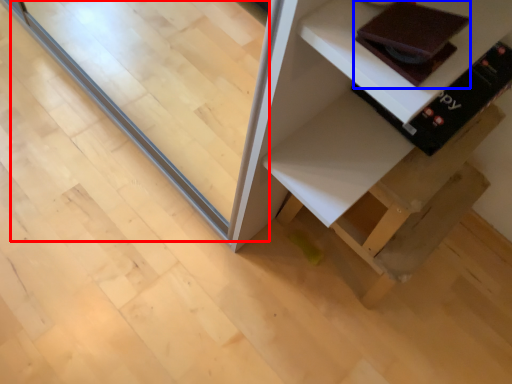
Question: Which object appears closest to the camera in this image, glass door (highlighted by a red box) or book (highlighted by a blue box)?

Choices:
 (A) glass door
 (B) book

Answer: (B)